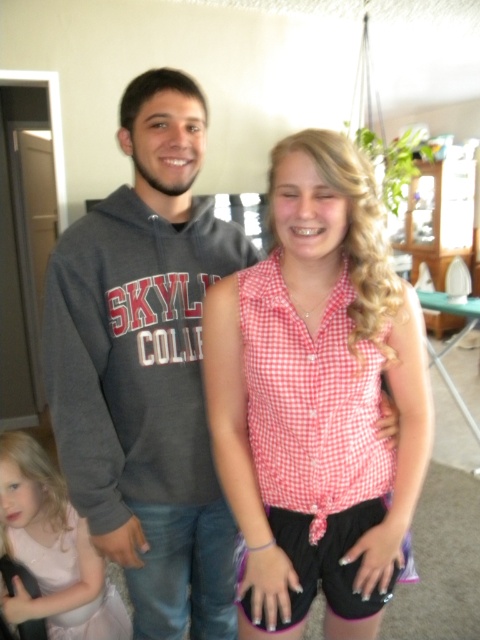
Question: Is dark gray hoodie at center smaller than pink satin dress at lower left?

Choices:
 (A) yes
 (B) no

Answer: (B)

Question: Which of the following is the closest to the observer?

Choices:
 (A) (84, 394)
 (B) (372, 209)

Answer: (B)

Question: Is dark gray hoodie at center further to camera compared to pink satin dress at lower left?

Choices:
 (A) yes
 (B) no

Answer: (B)

Question: Is pink checkered shirt at center above pink satin dress at lower left?

Choices:
 (A) yes
 (B) no

Answer: (A)

Question: Which point is closer to the camera?

Choices:
 (A) (108, 330)
 (B) (287, 570)
 (C) (34, 552)

Answer: (B)

Question: Among these points, which one is farthest from the camera?

Choices:
 (A) (12, 602)
 (B) (428, 433)
 (C) (181, 330)

Answer: (A)